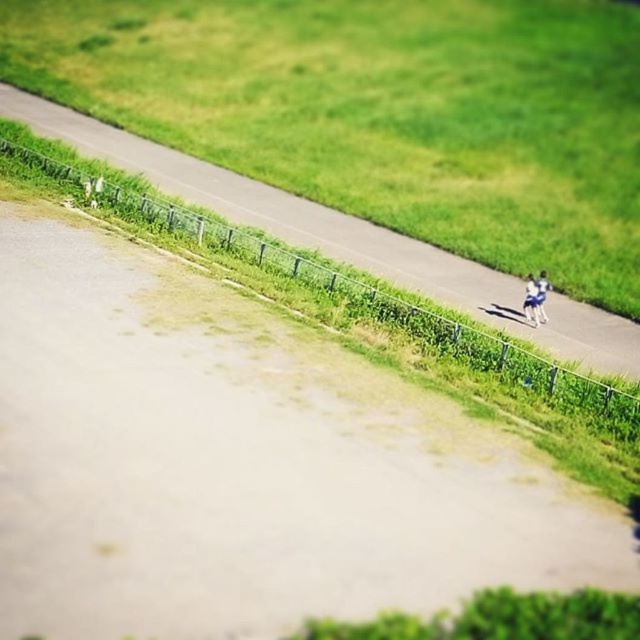
Question: Does asphalt road at center have a larger size compared to white fabric person at right?

Choices:
 (A) yes
 (B) no

Answer: (A)

Question: Is blue denim shorts at right positioned before white fabric person at right?

Choices:
 (A) no
 (B) yes

Answer: (B)

Question: Can you confirm if asphalt road at center is positioned below white fabric person at right?

Choices:
 (A) yes
 (B) no

Answer: (B)

Question: Which of the following is the farthest from the observer?

Choices:
 (A) (540, 317)
 (B) (410, 273)
 (C) (529, 280)

Answer: (B)

Question: Which point is farther from the camera taking this photo?

Choices:
 (A) (582, 358)
 (B) (541, 275)

Answer: (B)

Question: Which point appears closest to the camera in this image?

Choices:
 (A) (72, 124)
 (B) (541, 300)

Answer: (B)